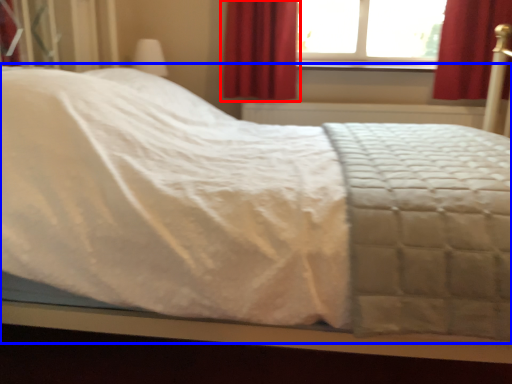
Question: Among these objects, which one is farthest to the camera, curtain (highlighted by a red box) or bed (highlighted by a blue box)?

Choices:
 (A) curtain
 (B) bed

Answer: (A)